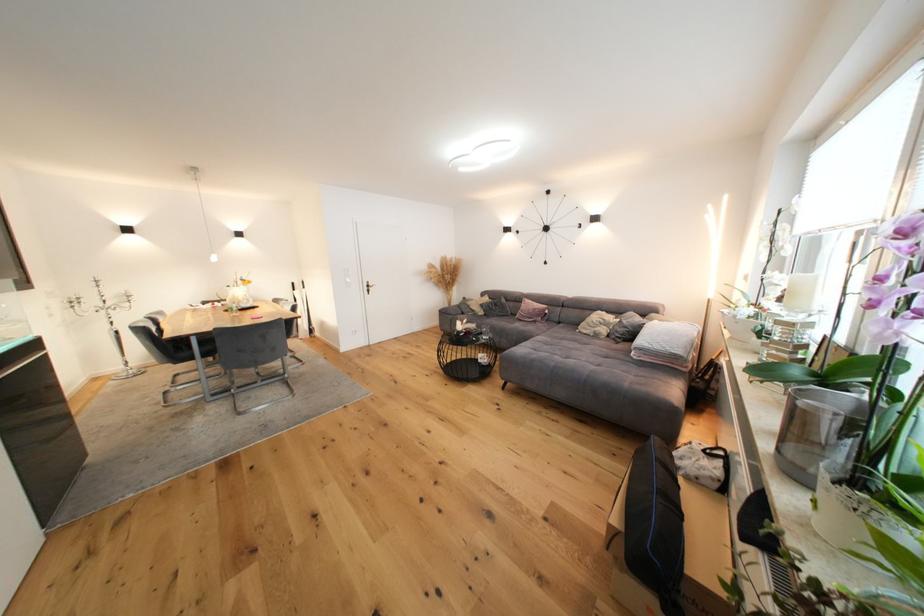
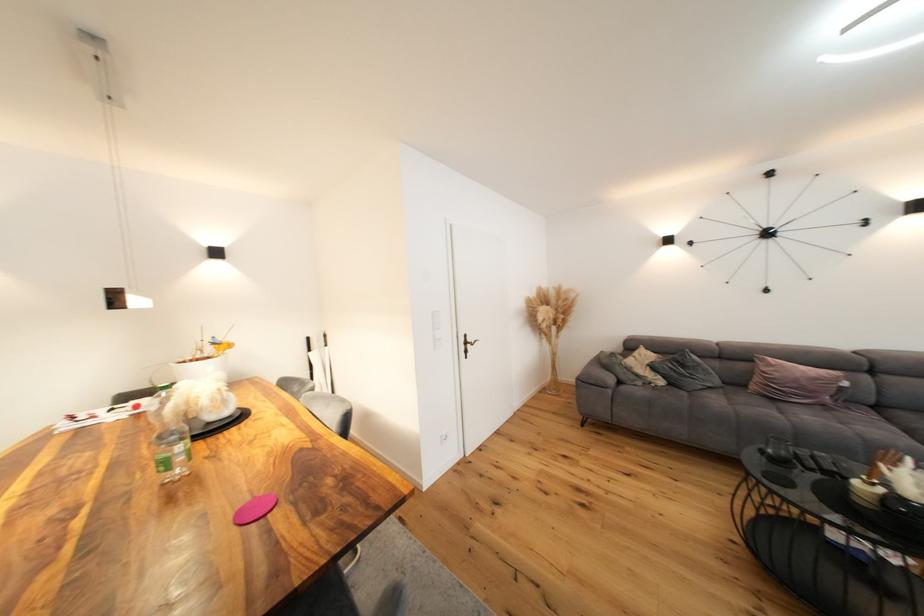
Locate, in the second image, the point that corresponds to [503,307] in the first image.

(690, 368)